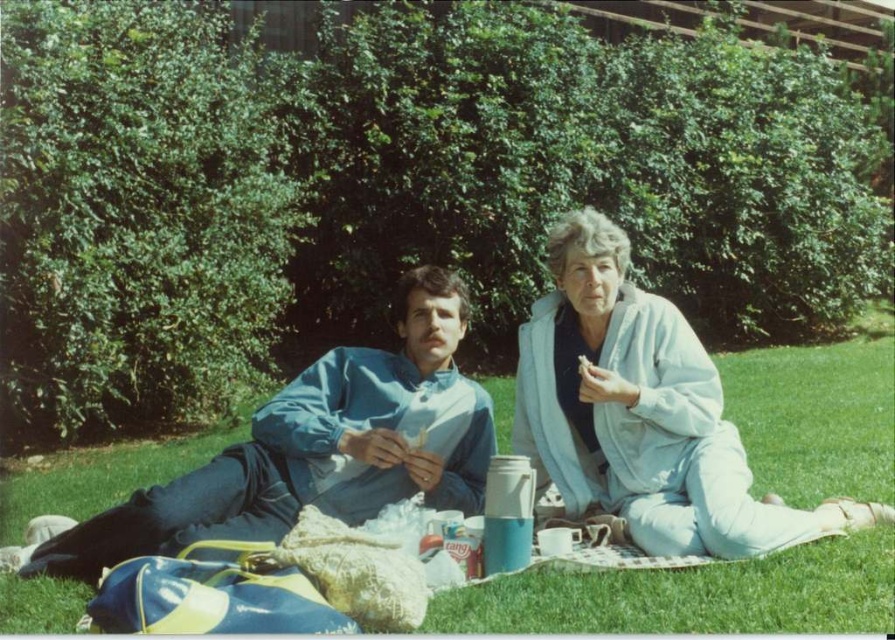
Question: Is light blue fabric pants at lower right above blue fabric jacket at center?

Choices:
 (A) yes
 (B) no

Answer: (A)

Question: Among these objects, which one is farthest from the camera?

Choices:
 (A) light blue fabric pants at lower right
 (B) blue fabric jacket at center

Answer: (A)

Question: Which point appears farthest from the camera in this image?

Choices:
 (A) (350, 456)
 (B) (484, 604)

Answer: (A)

Question: Does light blue fabric pants at lower right lie behind blue fabric jacket at center?

Choices:
 (A) yes
 (B) no

Answer: (A)

Question: Does green grass at center have a smaller size compared to light blue fabric pants at lower right?

Choices:
 (A) no
 (B) yes

Answer: (A)

Question: Estimate the real-world distances between objects in this image. Which object is farther from the light blue fabric pants at lower right?

Choices:
 (A) green grass at center
 (B) blue fabric jacket at center

Answer: (A)